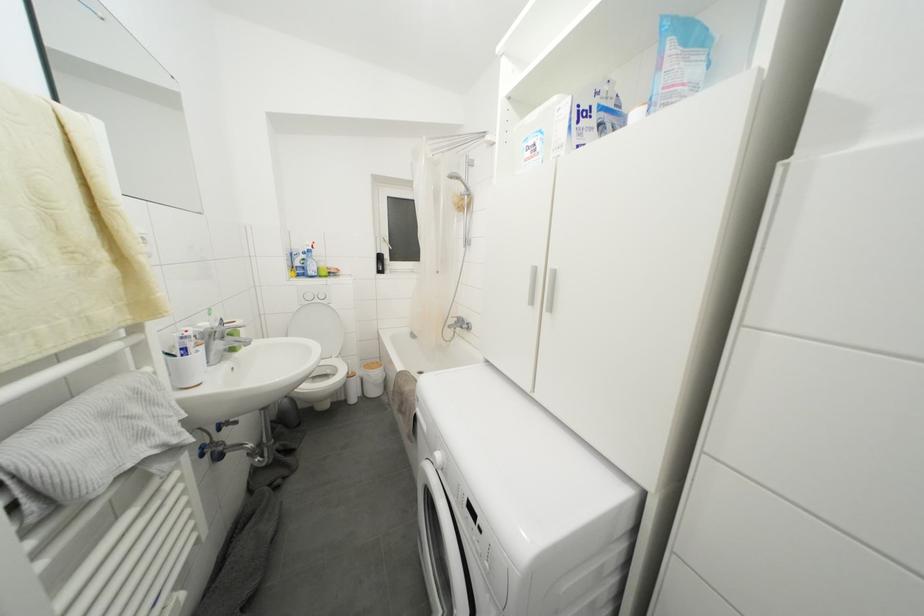
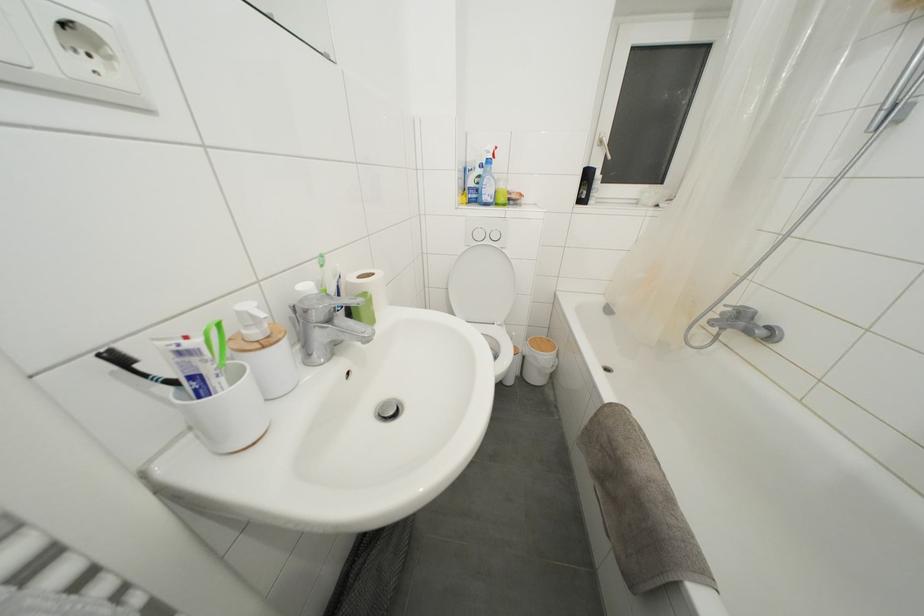
Where in the second image is the point corresponding to (x=314, y=277) from the first image?

(490, 203)